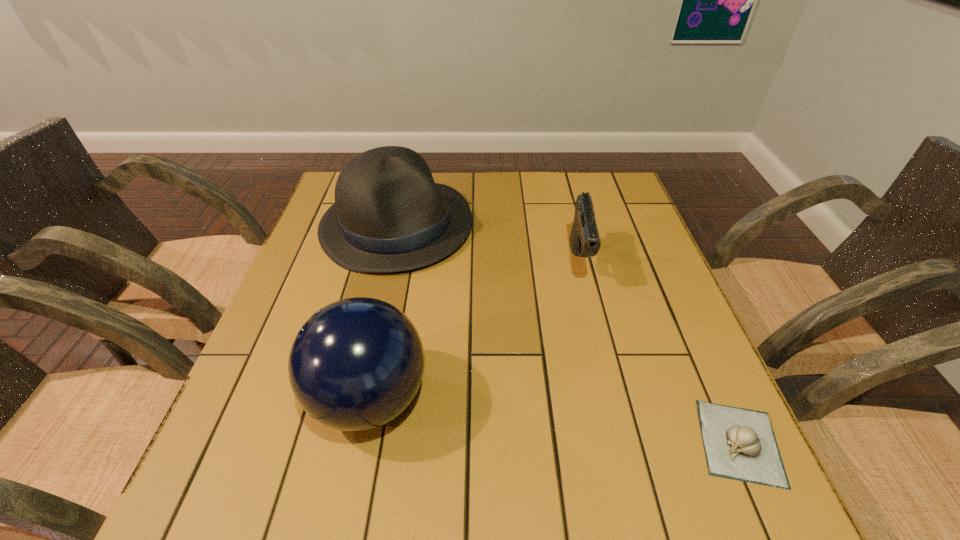
Find the location of a particular element. empty location between the garlic and the second object from right to left is located at coordinates (660, 352).

Identify the location of free space between the pistol and the bowling ball. (474, 330).

At what (x,y) coordinates should I click in order to perform the action: click on vacant area that lies between the rightmost object and the bowler hat. Please return your answer as a coordinate pair (x, y). The image size is (960, 540). Looking at the image, I should click on (568, 334).

Image resolution: width=960 pixels, height=540 pixels. In order to click on free spot between the shortest object and the bowler hat in this screenshot , I will do `click(568, 334)`.

Find the location of `vacant space that is in between the third object from left to right and the bowler hat`. vacant space that is in between the third object from left to right and the bowler hat is located at coordinates (489, 244).

Identify the location of vacant area between the bowling ball and the pistol. This screenshot has height=540, width=960. (474, 330).

Where is `empty location between the bowler hat and the rightmost object`? This screenshot has width=960, height=540. empty location between the bowler hat and the rightmost object is located at coordinates (568, 334).

What are the coordinates of `the third closest object to the third tallest object` in the screenshot? It's located at (356, 364).

Locate an element on the screen. object identified as the closest to the rightmost object is located at coordinates (584, 240).

Identify the location of free space that satisfies the following two spatial constraints: 1. on the front side of the bowler hat; 2. on the surface of the bowling ball near the finger holes. (357, 399).